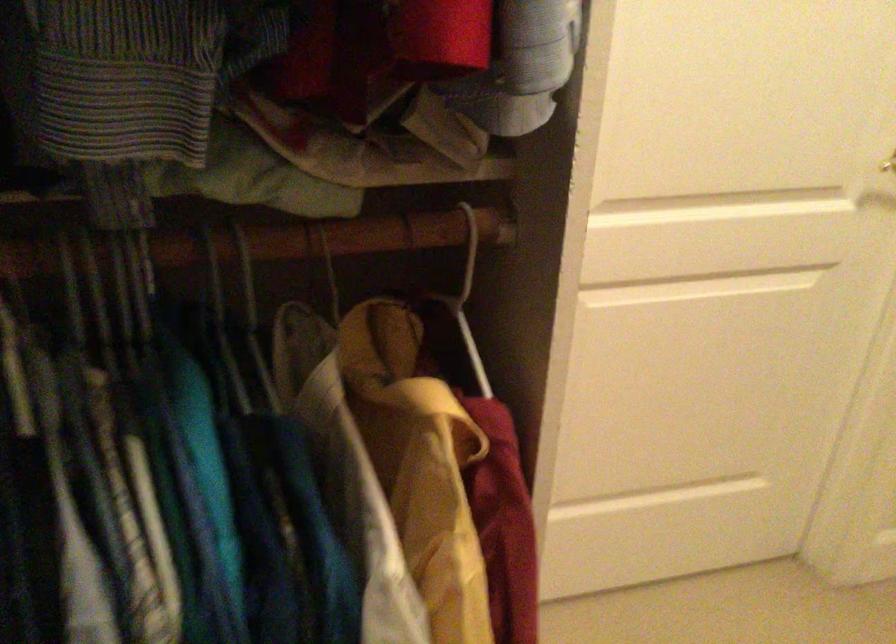
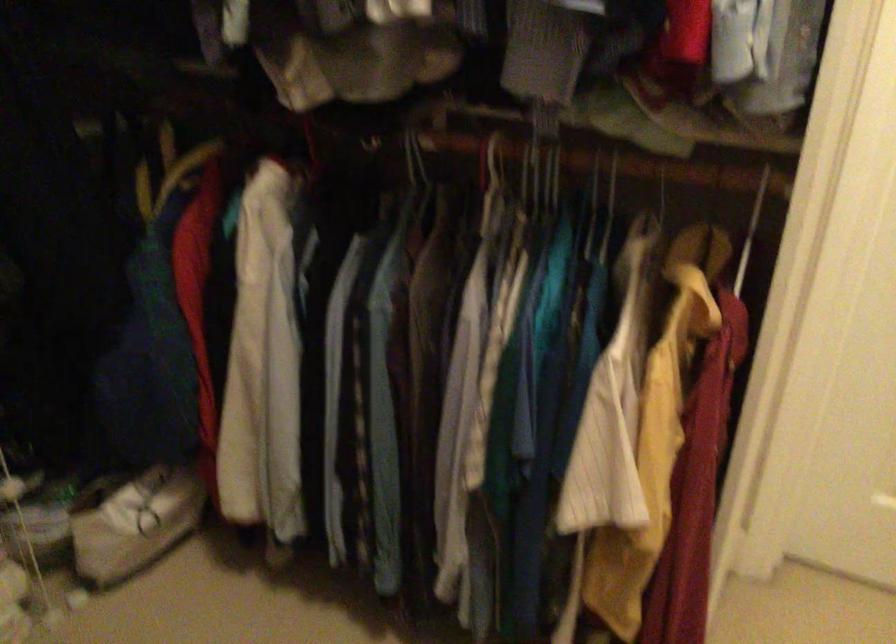
Question: Based on the continuous images, in which direction is the camera rotating? Reply with the corresponding letter.

Choices:
 (A) Left
 (B) Right
 (C) Up
 (D) Down

Answer: (A)